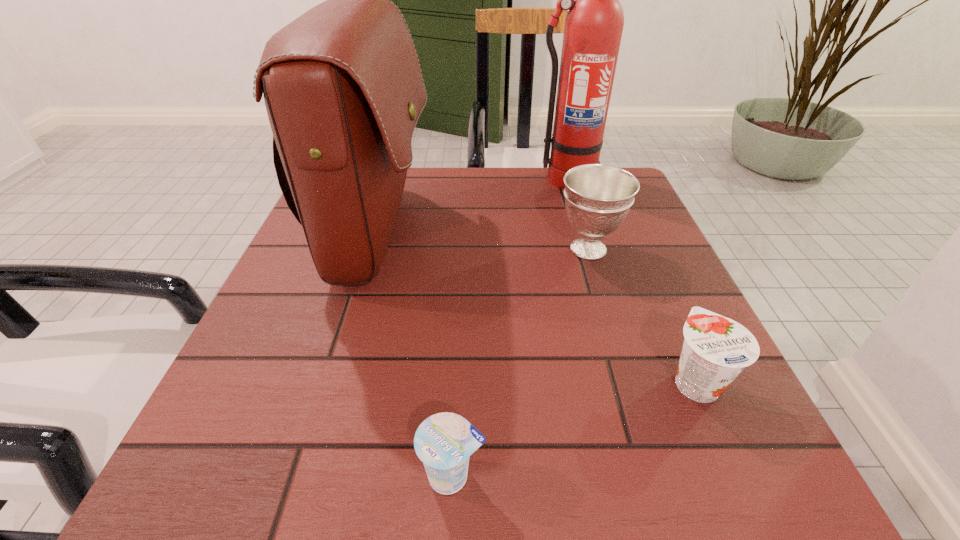
You are a GUI agent. You are given a task and a screenshot of the screen. Output one action in this format:
    pyautogui.click(x=<x>, y=<y>)
    Task: Click on the vacant space situated on the left of the right yogurt
    The height and width of the screenshot is (540, 960).
    Given the screenshot: What is the action you would take?
    pyautogui.click(x=438, y=381)

Where is `vacant region located 0.210m on the back of the nearer yogurt`? The width and height of the screenshot is (960, 540). vacant region located 0.210m on the back of the nearer yogurt is located at coordinates (460, 330).

Identify the location of fire extinguisher located at the far edge. (594, 23).

At what (x,y) coordinates should I click in order to perform the action: click on satchel that is at the far edge. Please return your answer as a coordinate pair (x, y). The height and width of the screenshot is (540, 960). Looking at the image, I should click on (343, 89).

At what (x,y) coordinates should I click in order to perform the action: click on object that is at the near edge. Please return your answer as a coordinate pair (x, y). Looking at the image, I should click on (444, 441).

Locate an element on the screen. Image resolution: width=960 pixels, height=540 pixels. object that is at the left edge is located at coordinates (343, 89).

The height and width of the screenshot is (540, 960). Identify the location of fire extinguisher at the right edge. (594, 23).

Image resolution: width=960 pixels, height=540 pixels. In order to click on chalice that is at the right edge in this screenshot , I will do `click(598, 197)`.

Find the location of a particular element. yogurt located in the right edge section of the desktop is located at coordinates (716, 349).

You are a GUI agent. You are given a task and a screenshot of the screen. Output one action in this format:
    pyautogui.click(x=<x>, y=<y>)
    Task: Click on the object present at the far left corner
    The width and height of the screenshot is (960, 540).
    Given the screenshot: What is the action you would take?
    pyautogui.click(x=343, y=89)